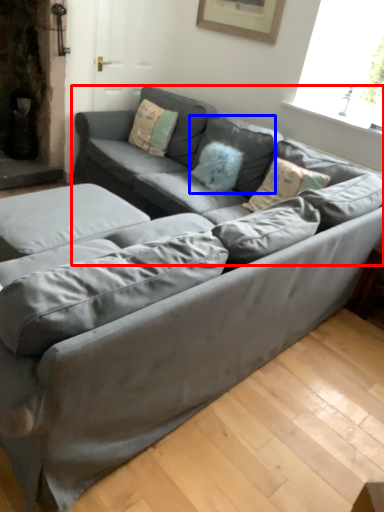
Question: Which of the following is the closest to the observer, couch (highlighted by a red box) or pillow (highlighted by a blue box)?

Choices:
 (A) couch
 (B) pillow

Answer: (A)